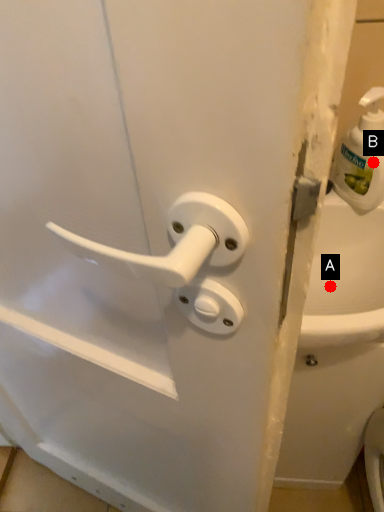
Question: Two points are circled on the image, labeled by A and B beside each circle. Which of the following is the farthest from the observer?

Choices:
 (A) A is further
 (B) B is further

Answer: (A)